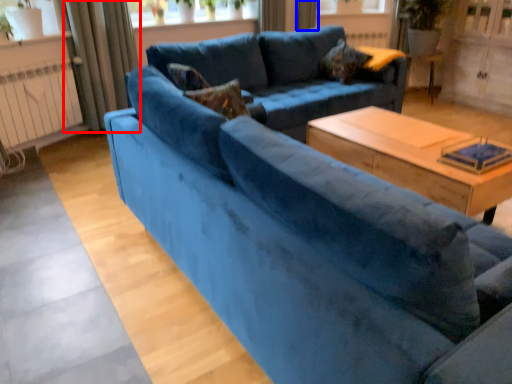
Question: Which of the following is the closest to the observer, curtain (highlighted by a red box) or curtain (highlighted by a blue box)?

Choices:
 (A) curtain
 (B) curtain

Answer: (A)